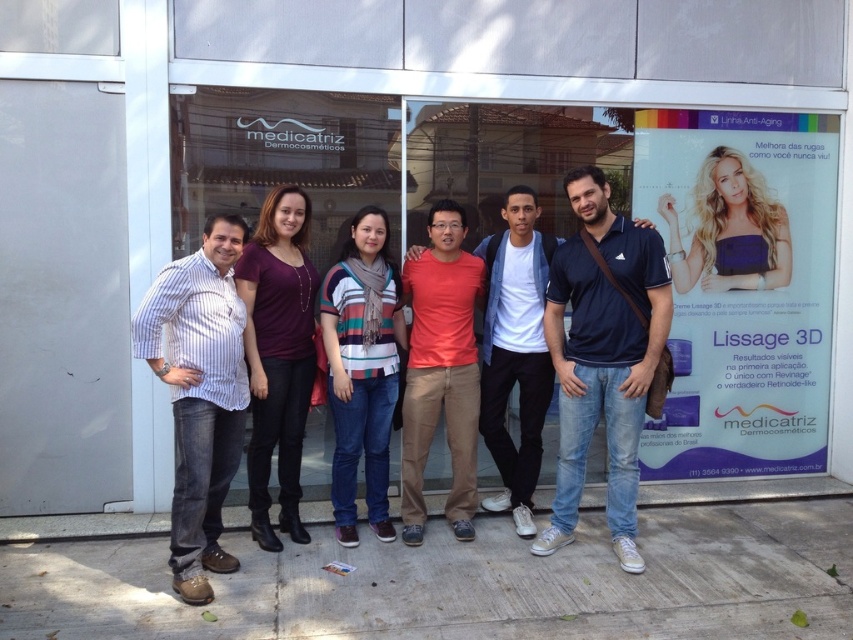
You are a photographer trying to compose a shot of the striped cotton shirt at left and the matte purple shirt at center. Which shirt should you zoom in on to ensure both shirts are fully visible in the frame?

The striped cotton shirt at left is shorter than the matte purple shirt at center, so you should zoom in on the matte purple shirt at center to ensure both shirts are fully visible in the frame.